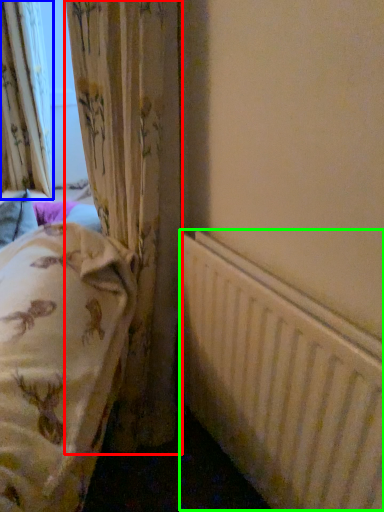
Question: Based on their relative distances, which object is farther from curtain (highlighted by a red box)? Choose from curtain (highlighted by a blue box) and radiator (highlighted by a green box).

Choices:
 (A) curtain
 (B) radiator

Answer: (A)